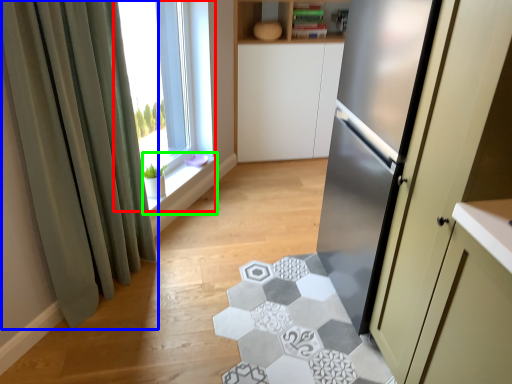
Question: Considering the real-world distances, which object is farthest from window (highlighted by a red box)? curtain (highlighted by a blue box) or window sill (highlighted by a green box)?

Choices:
 (A) curtain
 (B) window sill

Answer: (A)